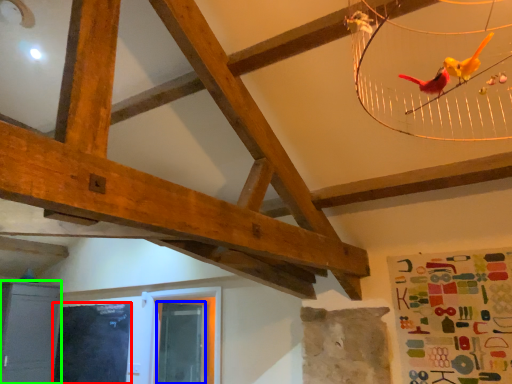
Question: Which is nearer to the window screen (highlighted by a red box)? window screen (highlighted by a blue box) or furniture (highlighted by a green box).

Choices:
 (A) window screen
 (B) furniture

Answer: (B)